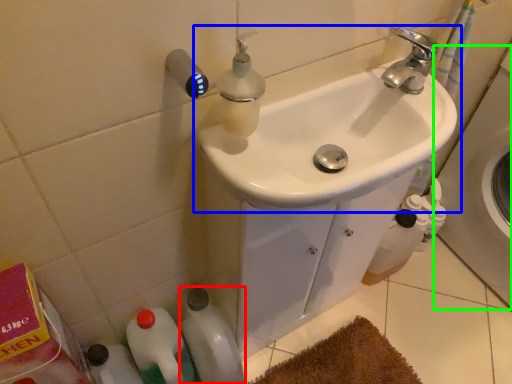
Question: Which object is the closest to the bottle (highlighted by a red box)? Choose among these: sink (highlighted by a blue box) or bath (highlighted by a green box).

Choices:
 (A) sink
 (B) bath

Answer: (A)